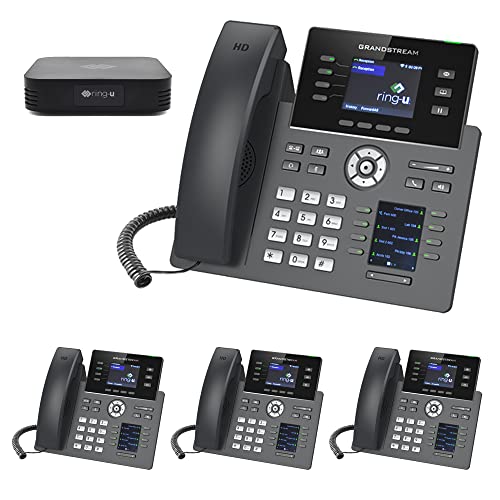
Where is `phone cord`? Image resolution: width=500 pixels, height=500 pixels. phone cord is located at coordinates (334, 448), (178, 451), (17, 444), (139, 267).